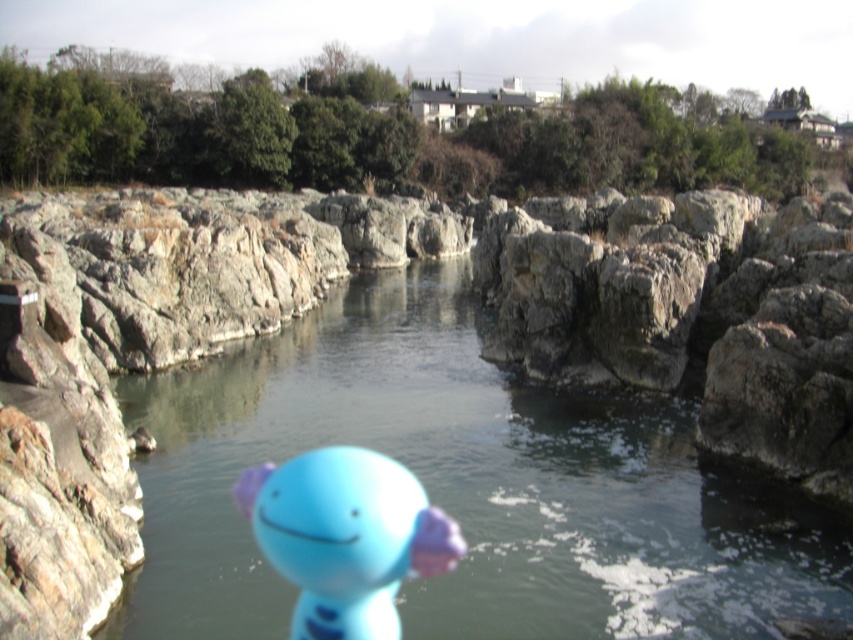
Question: Which point is farther from the camera taking this photo?

Choices:
 (A) (134, 458)
 (B) (357, 532)

Answer: (A)

Question: Does transparent plastic river at center have a greater width compared to matte blue plush toy at center?

Choices:
 (A) yes
 (B) no

Answer: (A)

Question: Which of the following is the closest to the observer?

Choices:
 (A) (436, 346)
 (B) (364, 502)

Answer: (B)

Question: Is transparent plastic river at center to the right of matte blue plush toy at center from the viewer's perspective?

Choices:
 (A) no
 (B) yes

Answer: (B)

Question: Which point is closer to the camera?

Choices:
 (A) matte blue plush toy at center
 (B) transparent plastic river at center

Answer: (B)

Question: From the image, what is the correct spatial relationship of transparent plastic river at center in relation to matte blue plush toy at center?

Choices:
 (A) above
 (B) below

Answer: (A)